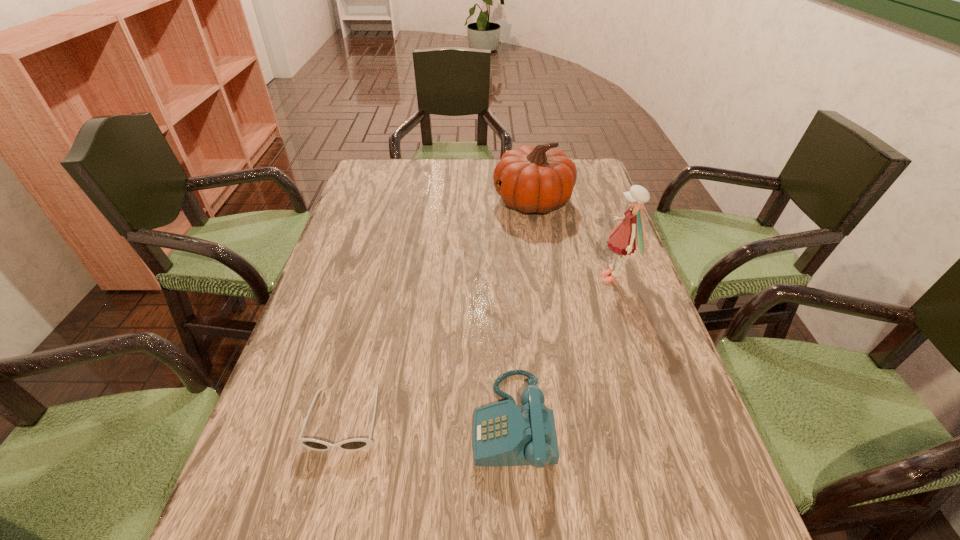
Image resolution: width=960 pixels, height=540 pixels. Identify the location of doll. (630, 233).

Locate an element on the screen. Image resolution: width=960 pixels, height=540 pixels. the tallest object is located at coordinates (630, 233).

You are a GUI agent. You are given a task and a screenshot of the screen. Output one action in this format:
    pyautogui.click(x=<x>, y=<y>)
    Task: Click on the farthest object
    Image resolution: width=960 pixels, height=540 pixels.
    Given the screenshot: What is the action you would take?
    pyautogui.click(x=538, y=179)

I want to click on pumpkin, so click(538, 179).

At what (x,y) coordinates should I click in order to perform the action: click on telephone. Please return your answer as a coordinate pair (x, y). The height and width of the screenshot is (540, 960). Looking at the image, I should click on (503, 434).

Locate an element on the screen. Image resolution: width=960 pixels, height=540 pixels. the leftmost object is located at coordinates (356, 444).

Where is `sunglasses`? This screenshot has height=540, width=960. sunglasses is located at coordinates (356, 444).

What are the coordinates of `free space located 0.080m on the front-facing side of the third nearest object` in the screenshot? It's located at (566, 279).

Image resolution: width=960 pixels, height=540 pixels. Find the location of `vacant region located 0.080m on the front-facing side of the third nearest object`. vacant region located 0.080m on the front-facing side of the third nearest object is located at coordinates (566, 279).

Where is `blank space located 0.340m on the front-facing side of the third nearest object`? blank space located 0.340m on the front-facing side of the third nearest object is located at coordinates (466, 279).